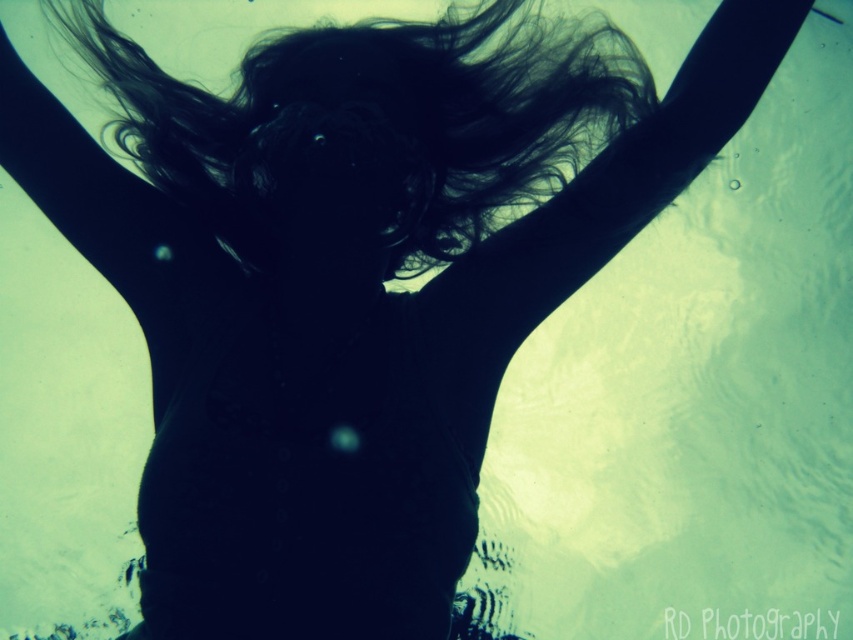
How much distance is there between black silky hair at center and black matte hair at upper center?

They are 6.49 inches apart.

Which of these two, black silky hair at center or black matte hair at upper center, stands taller?

With more height is black matte hair at upper center.

Where is `black silky hair at center`? black silky hair at center is located at coordinates (369, 128).

Locate an element on the screen. The height and width of the screenshot is (640, 853). black silky hair at center is located at coordinates point(369,128).